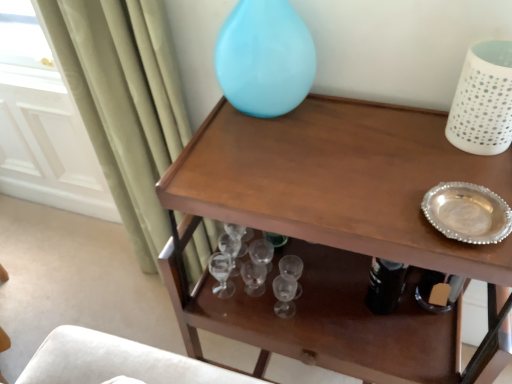
Question: Is white perforated vase at upper right, which is counted as the 1th vase, starting from the right, shorter than wooden table at upper center?

Choices:
 (A) yes
 (B) no

Answer: (A)

Question: Does white perforated vase at upper right, the second vase positioned from the left, have a greater height compared to wooden table at upper center?

Choices:
 (A) yes
 (B) no

Answer: (B)

Question: Is white perforated vase at upper right, the second vase positioned from the left, closer to the viewer compared to wooden table at upper center?

Choices:
 (A) no
 (B) yes

Answer: (A)

Question: Is white perforated vase at upper right, the second vase positioned from the left, bigger than wooden table at upper center?

Choices:
 (A) no
 (B) yes

Answer: (A)

Question: Does white perforated vase at upper right, the second vase positioned from the left, touch wooden table at upper center?

Choices:
 (A) no
 (B) yes

Answer: (A)

Question: From a real-world perspective, is white perforated vase at upper right, the second vase positioned from the left, located beneath wooden table at upper center?

Choices:
 (A) no
 (B) yes

Answer: (A)

Question: Is wooden table at upper center a part of glossy glass vase at upper center, marked as the 2th vase in a right-to-left arrangement?

Choices:
 (A) yes
 (B) no

Answer: (B)

Question: Is glossy glass vase at upper center, marked as the 2th vase in a right-to-left arrangement, facing towards wooden table at upper center?

Choices:
 (A) no
 (B) yes

Answer: (A)

Question: Can we say glossy glass vase at upper center, marked as the 2th vase in a right-to-left arrangement, lies outside wooden table at upper center?

Choices:
 (A) no
 (B) yes

Answer: (B)

Question: Is glossy glass vase at upper center, the first vase in the left-to-right sequence, at the left side of wooden table at upper center?

Choices:
 (A) no
 (B) yes

Answer: (B)

Question: Is glossy glass vase at upper center, the first vase in the left-to-right sequence, wider than wooden table at upper center?

Choices:
 (A) no
 (B) yes

Answer: (A)

Question: From the image's perspective, is glossy glass vase at upper center, marked as the 2th vase in a right-to-left arrangement, located beneath wooden table at upper center?

Choices:
 (A) yes
 (B) no

Answer: (B)

Question: Is wooden table at upper center located outside glossy glass vase at upper center, marked as the 2th vase in a right-to-left arrangement?

Choices:
 (A) no
 (B) yes

Answer: (B)